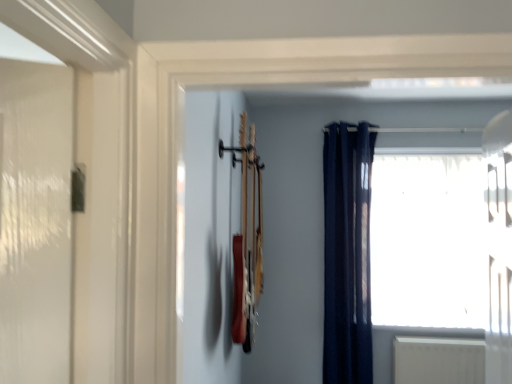
Question: Is point (389, 246) positioned closer to the camera than point (326, 324)?

Choices:
 (A) closer
 (B) farther

Answer: (B)

Question: From a real-world perspective, relative to navy blue fabric curtain at right, is transparent glass window at upper right vertically above or below?

Choices:
 (A) above
 (B) below

Answer: (A)

Question: Visually, is transparent glass window at upper right positioned to the left or to the right of navy blue fabric curtain at right?

Choices:
 (A) right
 (B) left

Answer: (A)

Question: Based on their positions, is navy blue fabric curtain at right located to the left or right of transparent glass window at upper right?

Choices:
 (A) left
 (B) right

Answer: (A)

Question: From the image's perspective, is navy blue fabric curtain at right positioned above or below transparent glass window at upper right?

Choices:
 (A) above
 (B) below

Answer: (B)

Question: From their relative heights in the image, would you say navy blue fabric curtain at right is taller or shorter than transparent glass window at upper right?

Choices:
 (A) short
 (B) tall

Answer: (B)

Question: From a real-world perspective, relative to transparent glass window at upper right, is navy blue fabric curtain at right vertically above or below?

Choices:
 (A) below
 (B) above

Answer: (A)